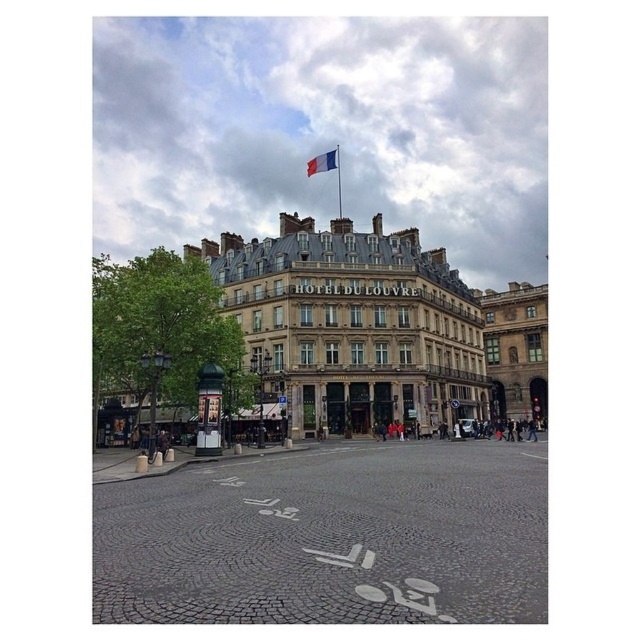
Question: Which is farther from the tricolor fabric flag at center top?

Choices:
 (A) white cobblestone plaza at center
 (B) blue metallic flag pole at upper center

Answer: (A)

Question: Is white cobblestone plaza at center wider than tricolor fabric flag at center top?

Choices:
 (A) yes
 (B) no

Answer: (A)

Question: Which point is farther from the camera taking this photo?

Choices:
 (A) (230, 314)
 (B) (337, 168)
 (C) (449, 522)
 (D) (324, 152)

Answer: (D)

Question: Which object appears farthest from the camera in this image?

Choices:
 (A) brown stone building at center
 (B) blue metallic flag pole at upper center

Answer: (B)

Question: In this image, where is tricolor fabric flag at center top located relative to blue metallic flag pole at upper center?

Choices:
 (A) left
 (B) right

Answer: (A)

Question: Is white cobblestone plaza at center bigger than tricolor fabric flag at center top?

Choices:
 (A) yes
 (B) no

Answer: (A)